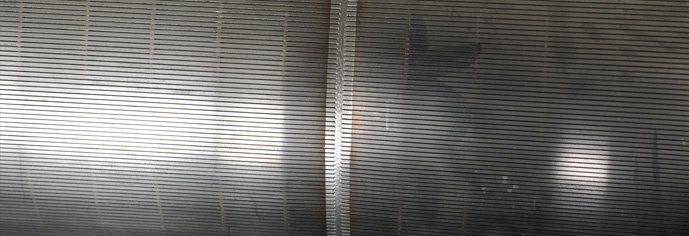
Where is `light reflecting on blinds`? This screenshot has width=689, height=236. light reflecting on blinds is located at coordinates (136, 134).